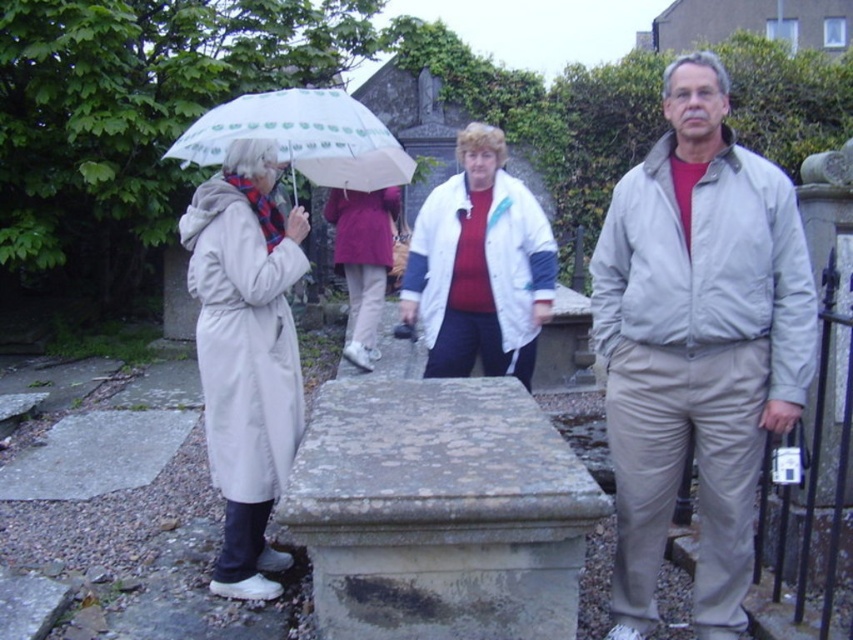
Is light beige trench coat at left to the right of white matte jacket at center from the viewer's perspective?

In fact, light beige trench coat at left is to the left of white matte jacket at center.

This screenshot has width=853, height=640. Find the location of `light beige trench coat at left`. light beige trench coat at left is located at coordinates (247, 353).

Identify the location of light beige trench coat at left. (247, 353).

This screenshot has width=853, height=640. What do you see at coordinates (697, 344) in the screenshot?
I see `light beige jacket at right` at bounding box center [697, 344].

Does light beige jacket at right appear on the right side of light beige trench coat at left?

Correct, you'll find light beige jacket at right to the right of light beige trench coat at left.

This screenshot has width=853, height=640. In order to click on light beige jacket at right in this screenshot , I will do `click(697, 344)`.

This screenshot has width=853, height=640. In order to click on light beige jacket at right in this screenshot , I will do `click(697, 344)`.

Is white matte jacket at center above maroon fabric coat at center?

Correct, white matte jacket at center is located above maroon fabric coat at center.

In the scene shown: Who is taller, white matte jacket at center or maroon fabric coat at center?

Standing taller between the two is maroon fabric coat at center.

Is point (401, 301) behind point (345, 273)?

No, it is not.

Where is `white matte jacket at center`? Image resolution: width=853 pixels, height=640 pixels. white matte jacket at center is located at coordinates (479, 266).